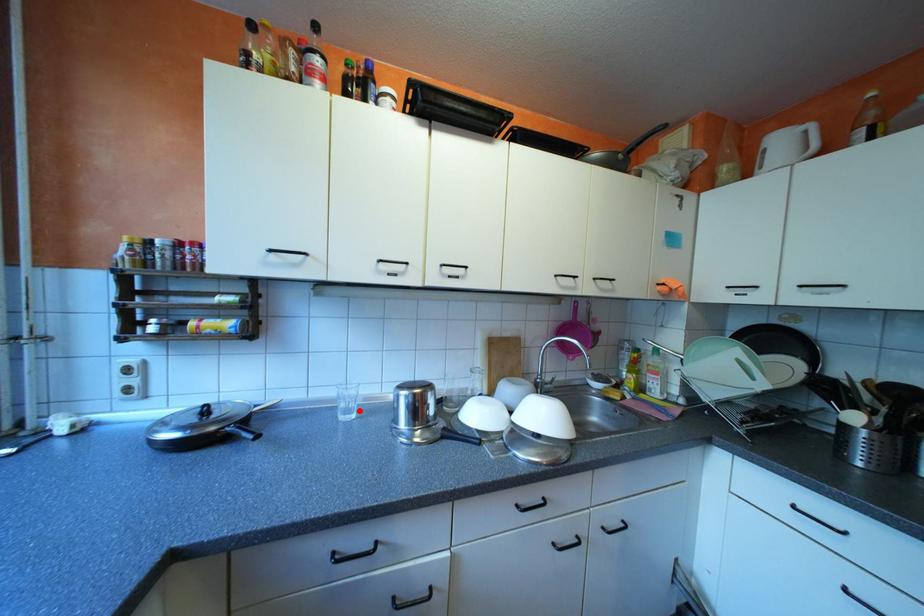
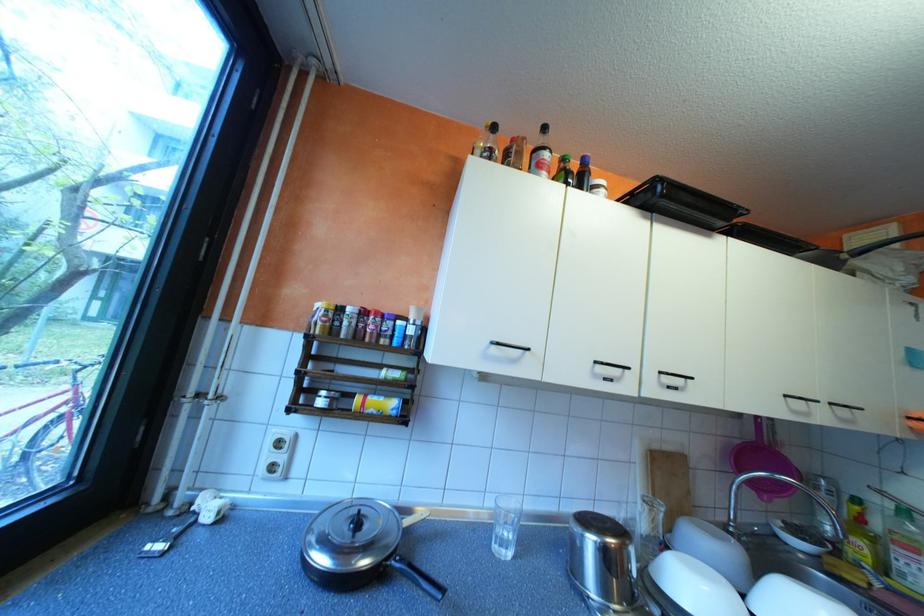
Find the pixel in the second image that matches the highlighted location in the first image.

(515, 541)